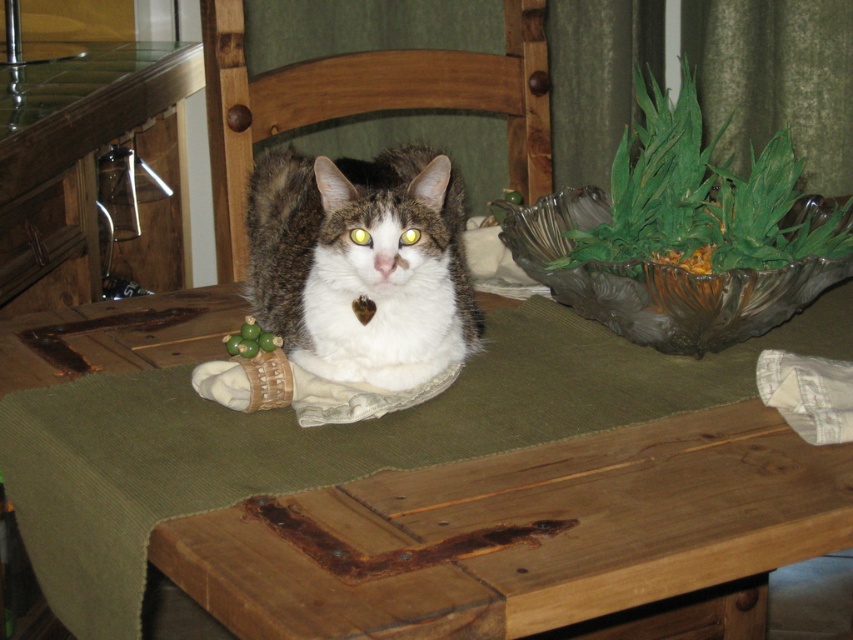
Question: Which of the following is the closest to the observer?

Choices:
 (A) (82, 253)
 (B) (416, 339)
 (C) (527, 90)

Answer: (B)

Question: Based on their relative distances, which object is nearer to the fuzzy brown and white cat at center?

Choices:
 (A) wooden table at left
 (B) wooden table at center

Answer: (B)

Question: Based on their relative distances, which object is farther from the wooden chair at center?

Choices:
 (A) wooden table at center
 (B) fuzzy brown and white cat at center

Answer: (A)

Question: Does fuzzy brown and white cat at center come in front of wooden table at left?

Choices:
 (A) no
 (B) yes

Answer: (B)

Question: In this image, where is wooden table at center located relative to wooden chair at center?

Choices:
 (A) right
 (B) left

Answer: (A)

Question: Is fuzzy brown and white cat at center to the right of wooden chair at center from the viewer's perspective?

Choices:
 (A) no
 (B) yes

Answer: (B)